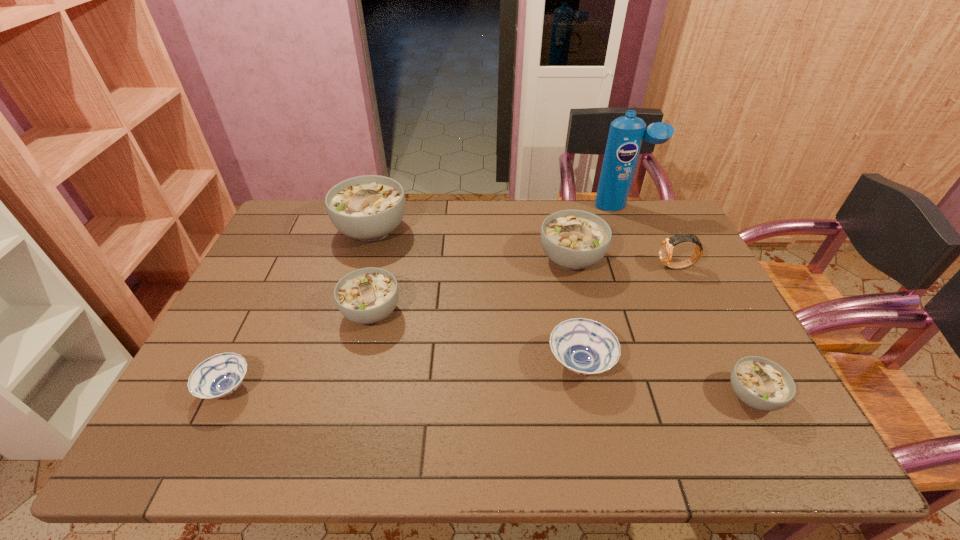
At what (x,y) coordinates should I click in order to perform the action: click on vacant area that lies between the watch and the second tallest object. Please return your answer as a coordinate pair (x, y). This screenshot has height=540, width=960. Looking at the image, I should click on (524, 248).

Where is `free point between the second smallest white soup bowl and the right blue soup bowl`? free point between the second smallest white soup bowl and the right blue soup bowl is located at coordinates (476, 338).

This screenshot has width=960, height=540. I want to click on unoccupied area between the third farthest white soup bowl and the second biggest white soup bowl, so [471, 286].

The height and width of the screenshot is (540, 960). Find the location of `unoccupied area between the smaller blue soup bowl and the watch`. unoccupied area between the smaller blue soup bowl and the watch is located at coordinates (452, 328).

You are a GUI agent. You are given a task and a screenshot of the screen. Output one action in this format:
    pyautogui.click(x=<x>, y=<y>)
    Task: Click on the vacant space that is in between the bigger blue soup bowl and the fifth tallest object
    The image size is (960, 540).
    Given the screenshot: What is the action you would take?
    pyautogui.click(x=476, y=338)

Identify the location of vacant point located between the tallest object and the gold watch. (649, 237).

The width and height of the screenshot is (960, 540). I want to click on object that is the sixth closest to the second nearest white soup bowl, so click(666, 247).

Identify the location of object that is the third closest one to the second tallest soup bowl. The width and height of the screenshot is (960, 540). (586, 347).

Find the location of `soup bowl object that ranks as the fifth closest to the fifth tallest object`. soup bowl object that ranks as the fifth closest to the fifth tallest object is located at coordinates (760, 383).

Locate an element on the screen. the fifth closest soup bowl relative to the third farthest soup bowl is located at coordinates (760, 383).